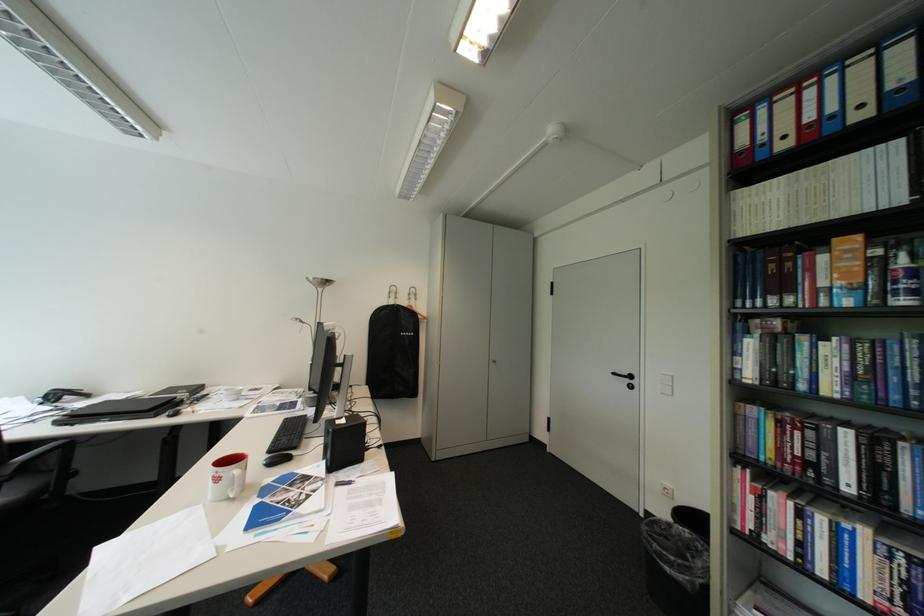
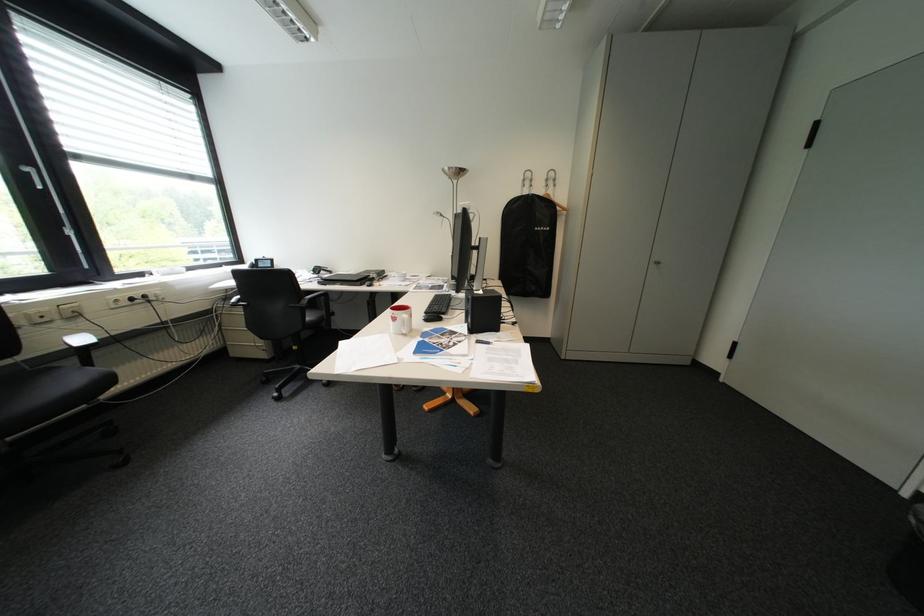
How did the camera likely rotate?

The rotation direction of the camera is left-down.